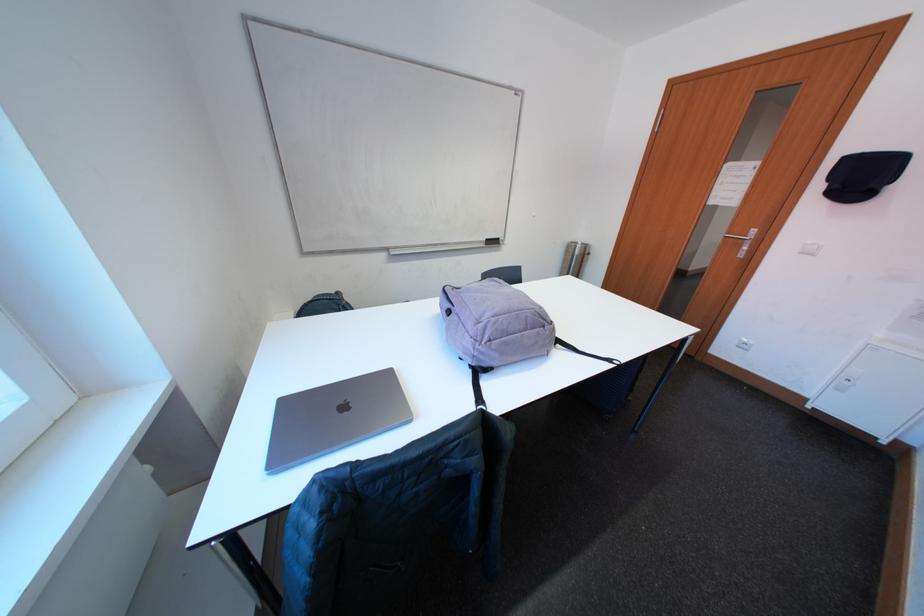
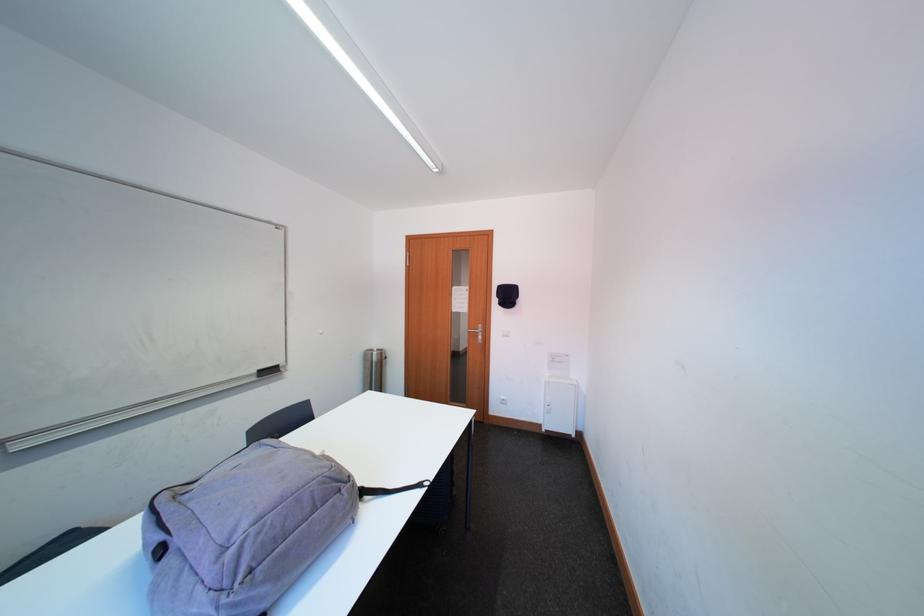
Locate, in the second image, the point that corresponds to point (553, 330) in the first image.

(349, 493)